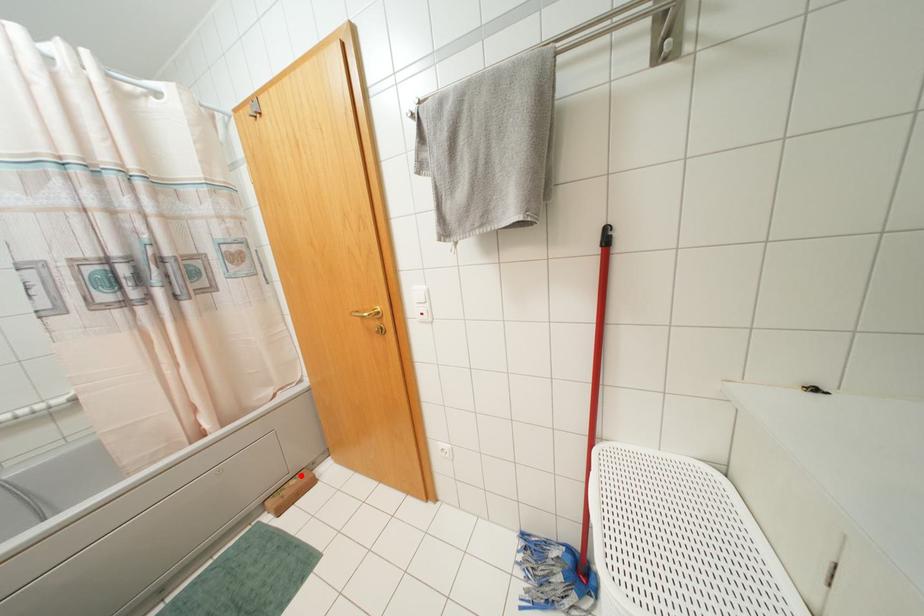
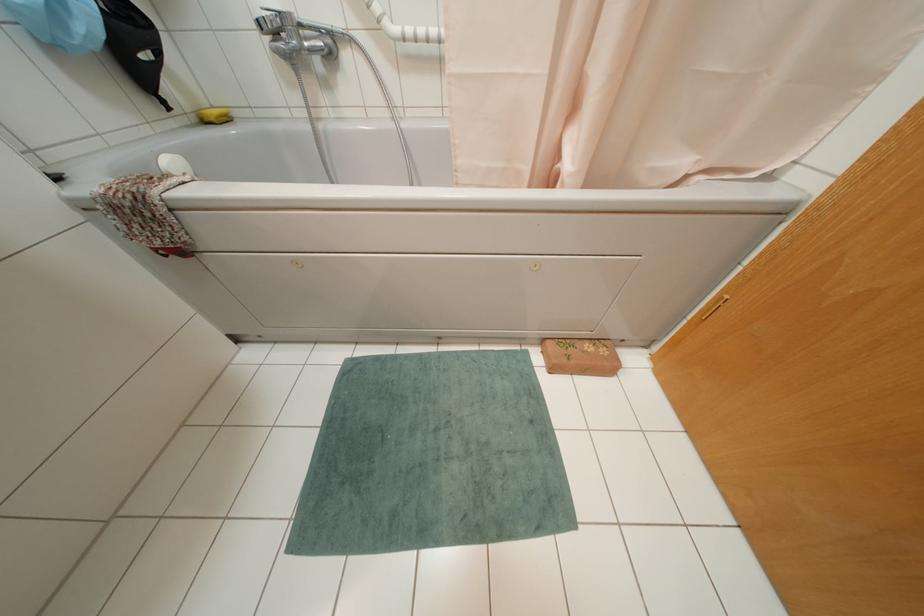
The point at the highlighted location is marked in the first image. Where is the corresponding point in the second image?

(602, 351)